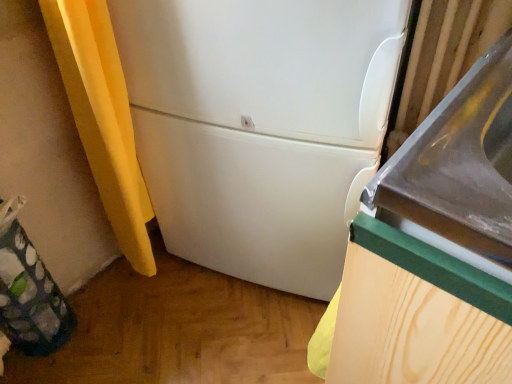
Question: From the image's perspective, would you say white matte refrigerator at center is shown under green fabric bag at lower left?

Choices:
 (A) yes
 (B) no

Answer: (B)

Question: Is green fabric bag at lower left surrounded by white matte refrigerator at center?

Choices:
 (A) yes
 (B) no

Answer: (B)

Question: From a real-world perspective, does white matte refrigerator at center stand above green fabric bag at lower left?

Choices:
 (A) yes
 (B) no

Answer: (A)

Question: Can you confirm if white matte refrigerator at center is taller than green fabric bag at lower left?

Choices:
 (A) yes
 (B) no

Answer: (A)

Question: From a real-world perspective, is white matte refrigerator at center physically below green fabric bag at lower left?

Choices:
 (A) yes
 (B) no

Answer: (B)

Question: Does white matte refrigerator at center have a lesser width compared to green fabric bag at lower left?

Choices:
 (A) yes
 (B) no

Answer: (B)

Question: Is white glossy sink at center right completely or partially inside white matte refrigerator at center?

Choices:
 (A) no
 (B) yes

Answer: (A)

Question: Considering the relative sizes of white matte refrigerator at center and white glossy sink at center right in the image provided, is white matte refrigerator at center shorter than white glossy sink at center right?

Choices:
 (A) no
 (B) yes

Answer: (A)

Question: Is the position of white matte refrigerator at center more distant than that of white glossy sink at center right?

Choices:
 (A) yes
 (B) no

Answer: (A)

Question: From a real-world perspective, is white matte refrigerator at center physically below white glossy sink at center right?

Choices:
 (A) no
 (B) yes

Answer: (A)

Question: Is white matte refrigerator at center outside of white glossy sink at center right?

Choices:
 (A) yes
 (B) no

Answer: (A)

Question: Considering the relative positions of white matte refrigerator at center and white glossy sink at center right in the image provided, is white matte refrigerator at center to the left of white glossy sink at center right from the viewer's perspective?

Choices:
 (A) no
 (B) yes

Answer: (B)

Question: Considering the relative sizes of white glossy sink at center right and green fabric bag at lower left in the image provided, is white glossy sink at center right thinner than green fabric bag at lower left?

Choices:
 (A) no
 (B) yes

Answer: (A)